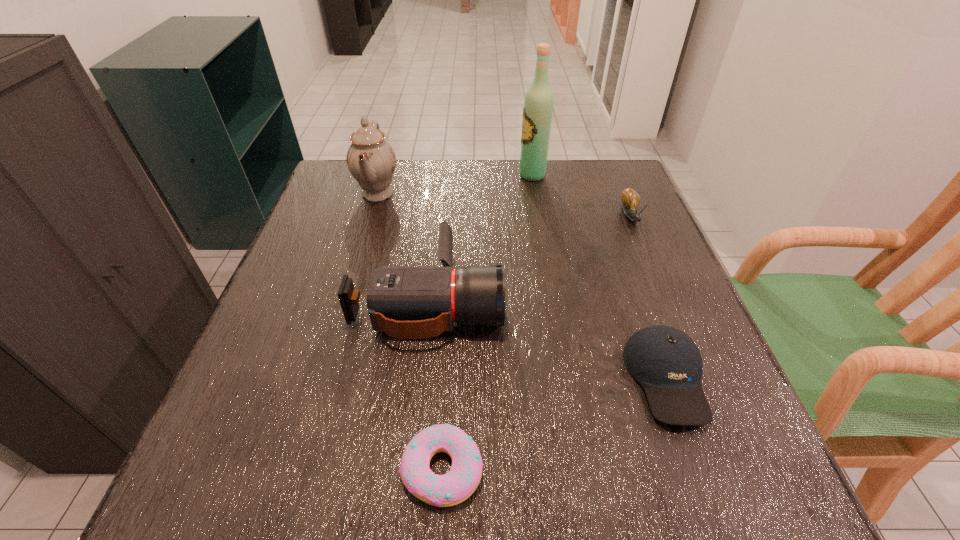
Locate an element on the screen. free space at the near right corner is located at coordinates (719, 453).

The width and height of the screenshot is (960, 540). I want to click on unoccupied area between the escargot and the baseball cap, so click(x=649, y=298).

Identify the location of unoccupied position between the fourth shortest object and the escargot. The image size is (960, 540). (530, 258).

Where is `free space between the doughnut and the camcorder`? This screenshot has height=540, width=960. free space between the doughnut and the camcorder is located at coordinates (435, 384).

This screenshot has height=540, width=960. What are the coordinates of `empty space between the escargot and the fourth object from left to right` in the screenshot? It's located at (582, 196).

Image resolution: width=960 pixels, height=540 pixels. In order to click on empty space between the third object from right to left and the escargot in this screenshot , I will do `click(582, 196)`.

Locate an element on the screen. This screenshot has height=540, width=960. free point between the shortest object and the baseball cap is located at coordinates (555, 424).

Identify the location of free point between the camcorder and the chinaware. (403, 246).

Find the location of a particular element. This screenshot has width=960, height=540. free spot between the baseball cap and the camcorder is located at coordinates (547, 339).

Locate an element on the screen. empty space between the fourth shortest object and the baseball cap is located at coordinates (547, 339).